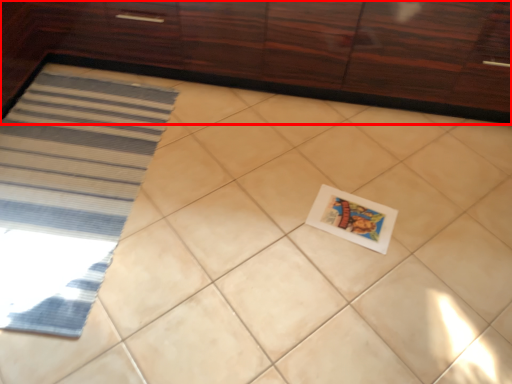
Question: Where is cabinetry (annotated by the red box) located in relation to postcard in the image?

Choices:
 (A) left
 (B) right

Answer: (A)